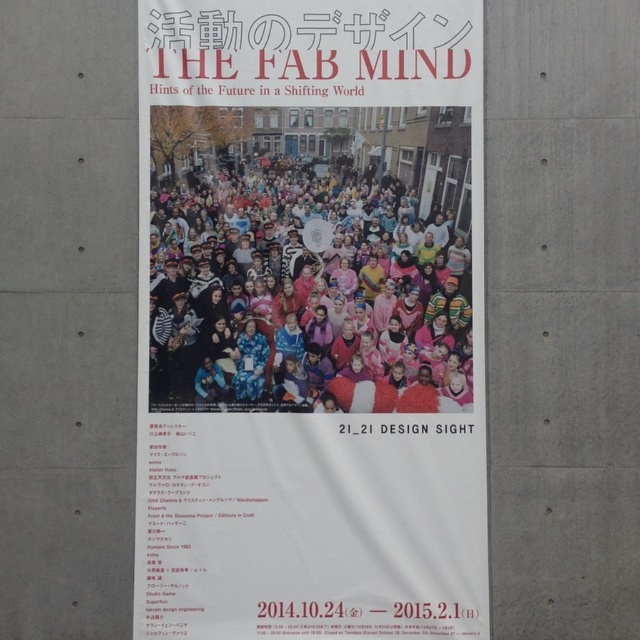
Can you confirm if white paper poster at upper center is wider than multicolored plush at center?

Indeed, white paper poster at upper center has a greater width compared to multicolored plush at center.

Does white paper poster at upper center have a lesser height compared to multicolored plush at center?

No, white paper poster at upper center is not shorter than multicolored plush at center.

Between point (412, 308) and point (193, 326), which one is positioned in front?

Point (193, 326)

You are a GUI agent. You are given a task and a screenshot of the screen. Output one action in this format:
    pyautogui.click(x=<x>, y=<y>)
    Task: Click on the white paper poster at upper center
    The width and height of the screenshot is (640, 640).
    Given the screenshot: What is the action you would take?
    pyautogui.click(x=310, y=321)